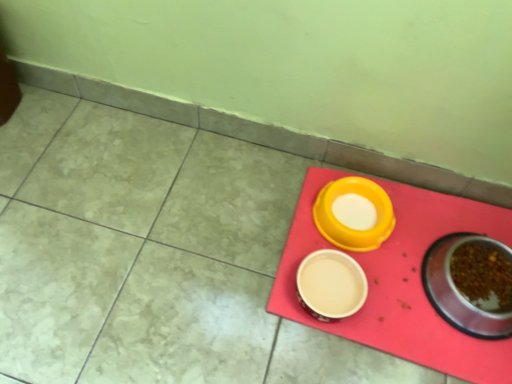
The image size is (512, 384). I want to click on yellow plastic bowl at center, which appears as the 2th tableware when viewed from the left, so click(350, 228).

What are the coordinates of `beige ceramic bowl at center, the first tableware in the left-to-right sequence` in the screenshot? It's located at (331, 285).

This screenshot has width=512, height=384. What do you see at coordinates (471, 284) in the screenshot? I see `metallic stainless steel bowl at lower right, which is counted as the first tableware, starting from the right` at bounding box center [471, 284].

I want to click on yellow plastic bowl at center, which appears as the 2th tableware when viewed from the left, so click(x=350, y=228).

From the picture: How many degrees apart are the facing directions of rubberized red tray at lower right and yellow plastic bowl at center, which ranks as the 2th tableware in right-to-left order?

There is a 1.62-degree angle between the facing directions of rubberized red tray at lower right and yellow plastic bowl at center, which ranks as the 2th tableware in right-to-left order.

From a real-world perspective, is rubberized red tray at lower right physically below yellow plastic bowl at center, which appears as the 2th tableware when viewed from the left?

Yes.

Which is behind, point (501, 214) or point (330, 194)?

The point (501, 214) is farther from the camera.

Is rubberized red tray at lower right situated inside yellow plastic bowl at center, which ranks as the 2th tableware in right-to-left order, or outside?

rubberized red tray at lower right exists outside the volume of yellow plastic bowl at center, which ranks as the 2th tableware in right-to-left order.

From the image's perspective, which tableware is the 2nd one below the yellow plastic bowl at center, which appears as the 2th tableware when viewed from the left? Please provide its 2D coordinates.

[(331, 285)]

Is yellow plastic bowl at center, which appears as the 2th tableware when viewed from the left, oriented towards beige ceramic bowl at center, placed as the 3th tableware when sorted from right to left?

Yes.

Who is shorter, yellow plastic bowl at center, which ranks as the 2th tableware in right-to-left order, or beige ceramic bowl at center, the first tableware in the left-to-right sequence?

Standing shorter between the two is beige ceramic bowl at center, the first tableware in the left-to-right sequence.

From a real-world perspective, is yellow plastic bowl at center, which ranks as the 2th tableware in right-to-left order, under beige ceramic bowl at center, the first tableware in the left-to-right sequence?

Incorrect, from a real-world perspective, yellow plastic bowl at center, which ranks as the 2th tableware in right-to-left order, is higher than beige ceramic bowl at center, the first tableware in the left-to-right sequence.

Can you confirm if rubberized red tray at lower right is taller than metallic stainless steel bowl at lower right, the third tableware positioned from the left?

Incorrect, the height of rubberized red tray at lower right is not larger of that of metallic stainless steel bowl at lower right, the third tableware positioned from the left.

Which is less distant, (380, 315) or (460, 257)?

Clearly, point (380, 315) is closer to the camera than point (460, 257).

Could you measure the distance between rubberized red tray at lower right and metallic stainless steel bowl at lower right, the third tableware positioned from the left?

rubberized red tray at lower right is 3.73 inches from metallic stainless steel bowl at lower right, the third tableware positioned from the left.

In the scene shown: From the image's perspective, relative to rubberized red tray at lower right, is beige ceramic bowl at center, placed as the 3th tableware when sorted from right to left, above or below?

beige ceramic bowl at center, placed as the 3th tableware when sorted from right to left, is situated lower than rubberized red tray at lower right in the image.

Considering the positions of objects beige ceramic bowl at center, placed as the 3th tableware when sorted from right to left, and rubberized red tray at lower right in the image provided, who is more to the left, beige ceramic bowl at center, placed as the 3th tableware when sorted from right to left, or rubberized red tray at lower right?

From the viewer's perspective, beige ceramic bowl at center, placed as the 3th tableware when sorted from right to left, appears more on the left side.

Measure the distance from beige ceramic bowl at center, placed as the 3th tableware when sorted from right to left, to rubberized red tray at lower right.

11.56 centimeters.

In the image, is beige ceramic bowl at center, placed as the 3th tableware when sorted from right to left, positioned in front of or behind rubberized red tray at lower right?

In the image, beige ceramic bowl at center, placed as the 3th tableware when sorted from right to left, appears behind rubberized red tray at lower right.

Considering the relative positions of rubberized red tray at lower right and beige ceramic bowl at center, placed as the 3th tableware when sorted from right to left, in the image provided, is rubberized red tray at lower right to the left of beige ceramic bowl at center, placed as the 3th tableware when sorted from right to left, from the viewer's perspective?

In fact, rubberized red tray at lower right is to the right of beige ceramic bowl at center, placed as the 3th tableware when sorted from right to left.

Considering the relative positions of rubberized red tray at lower right and beige ceramic bowl at center, placed as the 3th tableware when sorted from right to left, in the image provided, is rubberized red tray at lower right in front of beige ceramic bowl at center, placed as the 3th tableware when sorted from right to left,?

Yes, rubberized red tray at lower right is in front of beige ceramic bowl at center, placed as the 3th tableware when sorted from right to left.

In terms of width, does rubberized red tray at lower right look wider or thinner when compared to beige ceramic bowl at center, the first tableware in the left-to-right sequence?

rubberized red tray at lower right is wider than beige ceramic bowl at center, the first tableware in the left-to-right sequence.

How different are the orientations of rubberized red tray at lower right and beige ceramic bowl at center, placed as the 3th tableware when sorted from right to left, in degrees?

0.242 degrees separate the facing orientations of rubberized red tray at lower right and beige ceramic bowl at center, placed as the 3th tableware when sorted from right to left.

Are metallic stainless steel bowl at lower right, the third tableware positioned from the left, and beige ceramic bowl at center, placed as the 3th tableware when sorted from right to left, beside each other?

metallic stainless steel bowl at lower right, the third tableware positioned from the left, and beige ceramic bowl at center, placed as the 3th tableware when sorted from right to left, are clearly separated.

Which object is more forward, metallic stainless steel bowl at lower right, which is counted as the first tableware, starting from the right, or beige ceramic bowl at center, placed as the 3th tableware when sorted from right to left?

Positioned in front is metallic stainless steel bowl at lower right, which is counted as the first tableware, starting from the right.

Does metallic stainless steel bowl at lower right, which is counted as the first tableware, starting from the right, contain beige ceramic bowl at center, placed as the 3th tableware when sorted from right to left?

No, beige ceramic bowl at center, placed as the 3th tableware when sorted from right to left, is located outside of metallic stainless steel bowl at lower right, which is counted as the first tableware, starting from the right.

Which is less distant, (496, 282) or (307, 305)?

Point (496, 282).

From the picture: From the image's perspective, which object appears higher, yellow plastic bowl at center, which ranks as the 2th tableware in right-to-left order, or rubberized red tray at lower right?

From the image's view, yellow plastic bowl at center, which ranks as the 2th tableware in right-to-left order, is above.

Between point (330, 210) and point (283, 281), which one is positioned in front?

The point (283, 281) is closer.

Image resolution: width=512 pixels, height=384 pixels. Identify the location of the 1st tableware to the left of the rubberized red tray at lower right, starting your count from the anchor. (350, 228).

From a real-world perspective, count 2nd tablewares upward from the rubberized red tray at lower right and point to it. Please provide its 2D coordinates.

[(350, 228)]

The width and height of the screenshot is (512, 384). Find the location of `the 1st tableware in front of the yellow plastic bowl at center, which appears as the 2th tableware when viewed from the left, counting from the anchor's position`. the 1st tableware in front of the yellow plastic bowl at center, which appears as the 2th tableware when viewed from the left, counting from the anchor's position is located at coordinates (331, 285).

Looking at the image, which one is located closer to yellow plastic bowl at center, which appears as the 2th tableware when viewed from the left, metallic stainless steel bowl at lower right, the third tableware positioned from the left, or beige ceramic bowl at center, the first tableware in the left-to-right sequence?

The object closer to yellow plastic bowl at center, which appears as the 2th tableware when viewed from the left, is beige ceramic bowl at center, the first tableware in the left-to-right sequence.

Based on the photo, from the image, which object appears to be farther from rubberized red tray at lower right, beige ceramic bowl at center, placed as the 3th tableware when sorted from right to left, or metallic stainless steel bowl at lower right, the third tableware positioned from the left?

Based on the image, beige ceramic bowl at center, placed as the 3th tableware when sorted from right to left, appears to be further to rubberized red tray at lower right.

Considering their positions, is beige ceramic bowl at center, the first tableware in the left-to-right sequence, positioned closer to yellow plastic bowl at center, which appears as the 2th tableware when viewed from the left, than rubberized red tray at lower right?

beige ceramic bowl at center, the first tableware in the left-to-right sequence.

Based on their spatial positions, is yellow plastic bowl at center, which ranks as the 2th tableware in right-to-left order, or metallic stainless steel bowl at lower right, which is counted as the first tableware, starting from the right, further from beige ceramic bowl at center, the first tableware in the left-to-right sequence?

metallic stainless steel bowl at lower right, which is counted as the first tableware, starting from the right.

Which object lies nearer to the anchor point rubberized red tray at lower right, metallic stainless steel bowl at lower right, the third tableware positioned from the left, or beige ceramic bowl at center, placed as the 3th tableware when sorted from right to left?

Based on the image, metallic stainless steel bowl at lower right, the third tableware positioned from the left, appears to be nearer to rubberized red tray at lower right.

Which object lies further to the anchor point rubberized red tray at lower right, yellow plastic bowl at center, which ranks as the 2th tableware in right-to-left order, or metallic stainless steel bowl at lower right, which is counted as the first tableware, starting from the right?

yellow plastic bowl at center, which ranks as the 2th tableware in right-to-left order, lies further to rubberized red tray at lower right than the other object.

Estimate the real-world distances between objects in this image. Which object is closer to yellow plastic bowl at center, which appears as the 2th tableware when viewed from the left, metallic stainless steel bowl at lower right, the third tableware positioned from the left, or rubberized red tray at lower right?

The object closer to yellow plastic bowl at center, which appears as the 2th tableware when viewed from the left, is rubberized red tray at lower right.

Considering their positions, is beige ceramic bowl at center, the first tableware in the left-to-right sequence, positioned closer to metallic stainless steel bowl at lower right, which is counted as the first tableware, starting from the right, than rubberized red tray at lower right?

rubberized red tray at lower right.

Locate an element on the screen. The image size is (512, 384). table located between yellow plastic bowl at center, which appears as the 2th tableware when viewed from the left, and metallic stainless steel bowl at lower right, which is counted as the first tableware, starting from the right, in the left-right direction is located at coordinates (400, 280).

Where is `tableware situated between beige ceramic bowl at center, the first tableware in the left-to-right sequence, and rubberized red tray at lower right from left to right`? tableware situated between beige ceramic bowl at center, the first tableware in the left-to-right sequence, and rubberized red tray at lower right from left to right is located at coordinates (350, 228).

Identify the location of tableware between beige ceramic bowl at center, placed as the 3th tableware when sorted from right to left, and metallic stainless steel bowl at lower right, which is counted as the first tableware, starting from the right, from left to right. (350, 228).

Where is `table between beige ceramic bowl at center, the first tableware in the left-to-right sequence, and metallic stainless steel bowl at lower right, which is counted as the first tableware, starting from the right, from left to right`? This screenshot has width=512, height=384. table between beige ceramic bowl at center, the first tableware in the left-to-right sequence, and metallic stainless steel bowl at lower right, which is counted as the first tableware, starting from the right, from left to right is located at coordinates (400, 280).